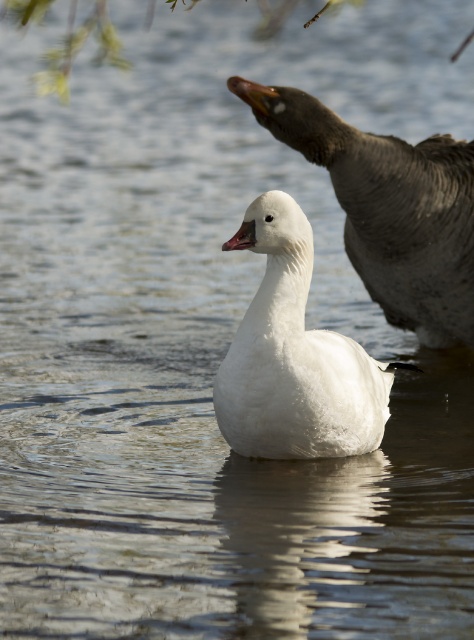
Between dark gray matte goose at upper right and matte pink beak at center, which one appears on the right side from the viewer's perspective?

dark gray matte goose at upper right is more to the right.

Can you confirm if dark gray matte goose at upper right is bigger than matte pink beak at center?

Yes, dark gray matte goose at upper right is bigger than matte pink beak at center.

Where is `dark gray matte goose at upper right`? Image resolution: width=474 pixels, height=640 pixels. dark gray matte goose at upper right is located at coordinates (390, 209).

Find the location of a particular element. The width and height of the screenshot is (474, 640). dark gray matte goose at upper right is located at coordinates (390, 209).

In the scene shown: Between white matte goose at center and matte pink beak at center, which one has more height?

With more height is white matte goose at center.

Is white matte goose at center thinner than matte pink beak at center?

No, white matte goose at center is not thinner than matte pink beak at center.

Measure the distance between white matte goose at center and camera.

They are 2.69 meters apart.

Where is `white matte goose at center`? The image size is (474, 640). white matte goose at center is located at coordinates (295, 358).

Who is taller, dark gray matte goose at upper right or white matte goose at center?

dark gray matte goose at upper right is taller.

Is point (257, 108) positioned before point (354, 433)?

No, it is not.

Locate an element on the screen. The width and height of the screenshot is (474, 640). dark gray matte goose at upper right is located at coordinates pyautogui.click(x=390, y=209).